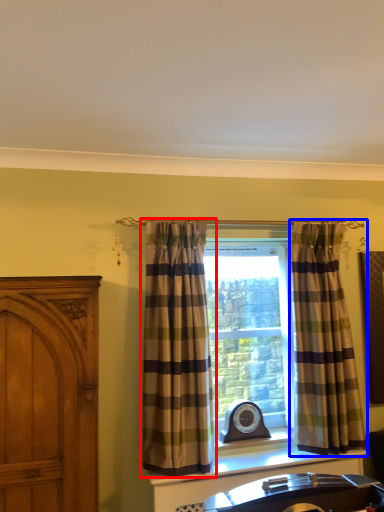
Question: Among these objects, which one is nearest to the camera, curtain (highlighted by a red box) or curtain (highlighted by a blue box)?

Choices:
 (A) curtain
 (B) curtain

Answer: (A)